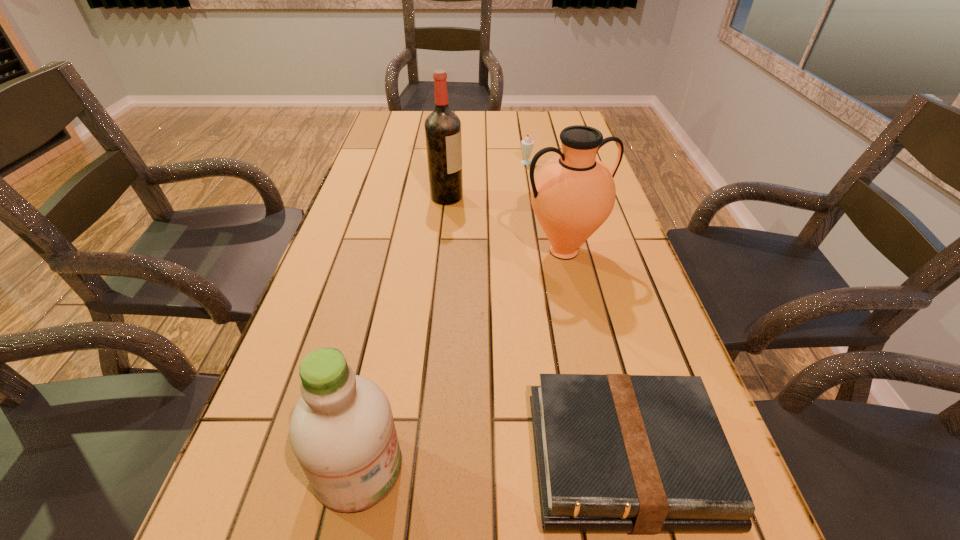
Locate an element on the screen. vacant region between the milkshake and the liquor is located at coordinates (488, 180).

Where is `vacant area that lies between the cleansing agent and the hardback book`? vacant area that lies between the cleansing agent and the hardback book is located at coordinates [492, 463].

Find the location of a particular element. free space between the hardback book and the third nearest object is located at coordinates (594, 355).

Where is `free point between the milkshake and the hardback book`? This screenshot has width=960, height=540. free point between the milkshake and the hardback book is located at coordinates (576, 310).

Locate an element on the screen. vacant space in between the pitcher and the liquor is located at coordinates (505, 224).

The width and height of the screenshot is (960, 540). I want to click on vacant space that is in between the shortest object and the fourth tallest object, so click(576, 310).

Image resolution: width=960 pixels, height=540 pixels. Identify the location of free point between the second farthest object and the pitcher. (505, 224).

Identify the location of empty space that is in between the pitcher and the third shortest object. (461, 360).

Identify which object is the third closest to the third nearest object. Please provide its 2D coordinates. Your answer should be formatted as a tuple, i.e. [(x, y)], where the tuple contains the x and y coordinates of a point satisfying the conditions above.

[(527, 144)]

Choose which object is the second nearest neighbor to the third shortest object. Please provide its 2D coordinates. Your answer should be formatted as a tuple, i.e. [(x, y)], where the tuple contains the x and y coordinates of a point satisfying the conditions above.

[(573, 194)]